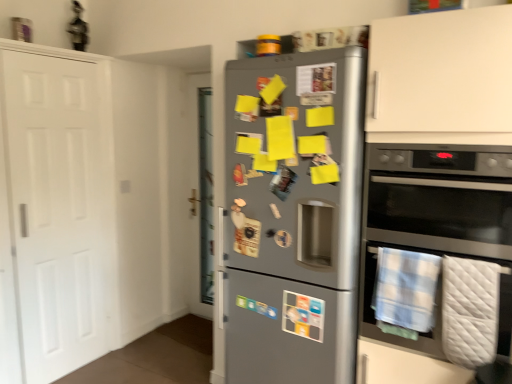
Question: Is blue plaid towel at lower right, which is counted as the second blanket, starting from the right, facing towards white quilted blanket at lower right, which is the second blanket from left to right?

Choices:
 (A) yes
 (B) no

Answer: (B)

Question: Is blue plaid towel at lower right, which is counted as the second blanket, starting from the right, oriented away from white quilted blanket at lower right, which ranks as the first blanket in right-to-left order?

Choices:
 (A) yes
 (B) no

Answer: (B)

Question: From a real-world perspective, is blue plaid towel at lower right, which is counted as the second blanket, starting from the right, under white quilted blanket at lower right, which is the second blanket from left to right?

Choices:
 (A) no
 (B) yes

Answer: (A)

Question: Is blue plaid towel at lower right, which is counted as the second blanket, starting from the right, at the right side of white quilted blanket at lower right, which is the second blanket from left to right?

Choices:
 (A) yes
 (B) no

Answer: (B)

Question: Is blue plaid towel at lower right, which is counted as the first blanket, starting from the left, at the left side of white quilted blanket at lower right, which ranks as the first blanket in right-to-left order?

Choices:
 (A) no
 (B) yes

Answer: (B)

Question: Is blue plaid towel at lower right, which is counted as the first blanket, starting from the left, surrounding white quilted blanket at lower right, which is the second blanket from left to right?

Choices:
 (A) yes
 (B) no

Answer: (B)

Question: From the image's perspective, is stainless steel oven at right located above white matte door at left?

Choices:
 (A) no
 (B) yes

Answer: (A)

Question: Is white matte door at left located within stainless steel oven at right?

Choices:
 (A) no
 (B) yes

Answer: (A)

Question: Considering the relative sizes of stainless steel oven at right and white matte door at left in the image provided, is stainless steel oven at right smaller than white matte door at left?

Choices:
 (A) yes
 (B) no

Answer: (B)

Question: Does stainless steel oven at right appear on the right side of white matte door at left?

Choices:
 (A) no
 (B) yes

Answer: (B)

Question: Is stainless steel oven at right directly adjacent to white matte door at left?

Choices:
 (A) yes
 (B) no

Answer: (B)

Question: Is stainless steel oven at right positioned behind white matte door at left?

Choices:
 (A) no
 (B) yes

Answer: (A)

Question: Does white matte door at left come behind white quilted blanket at lower right, which is the second blanket from left to right?

Choices:
 (A) no
 (B) yes

Answer: (B)